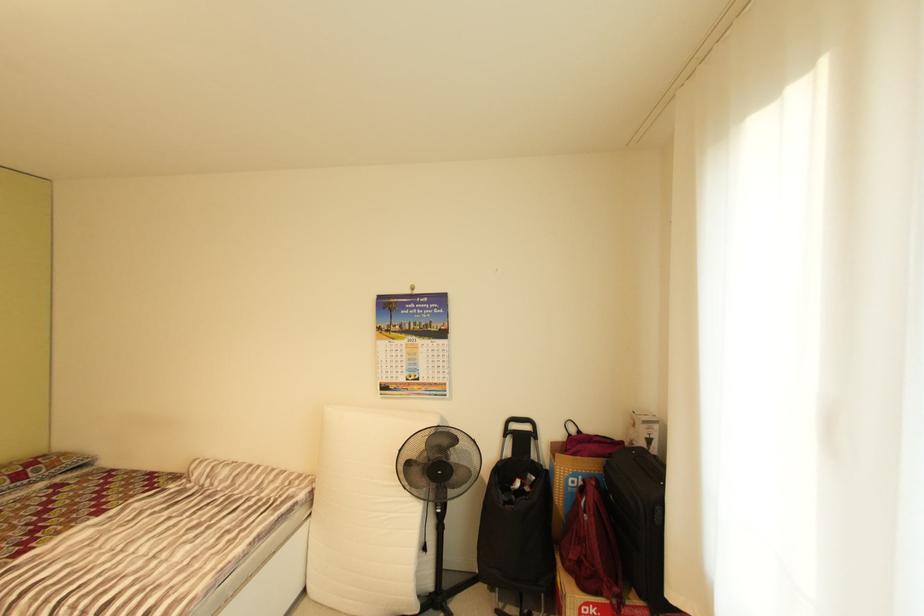
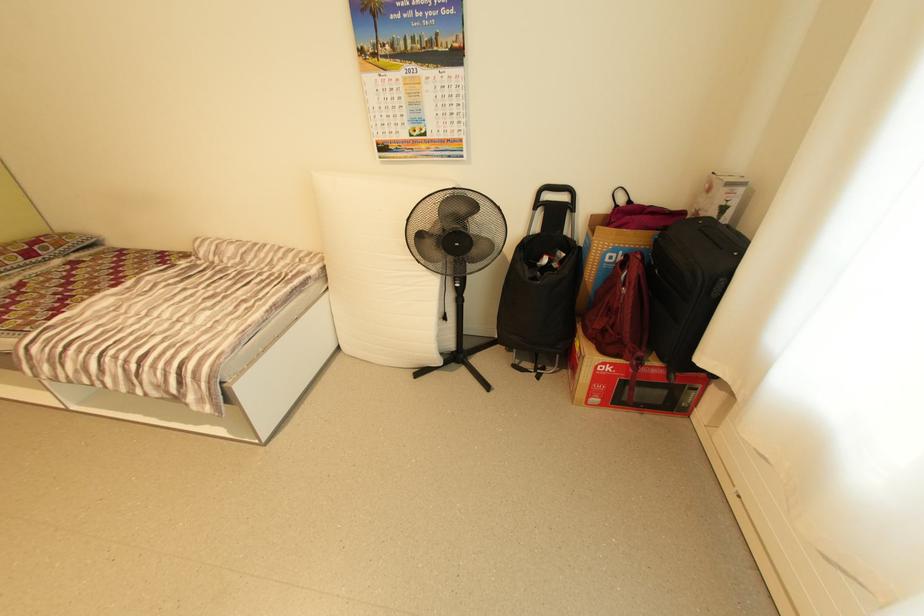
The point at (533, 428) is marked in the first image. Where is the corresponding point in the second image?

(570, 198)